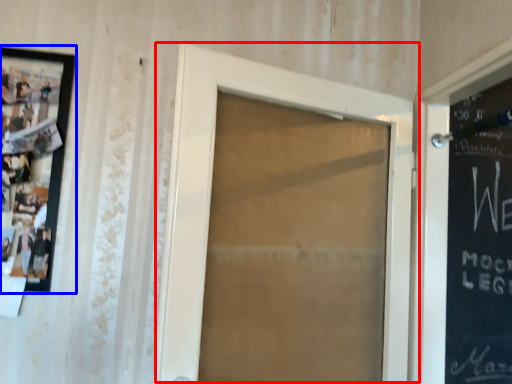
Question: Which object is further to the camera taking this photo, door (highlighted by a red box) or picture frame (highlighted by a blue box)?

Choices:
 (A) door
 (B) picture frame

Answer: (B)